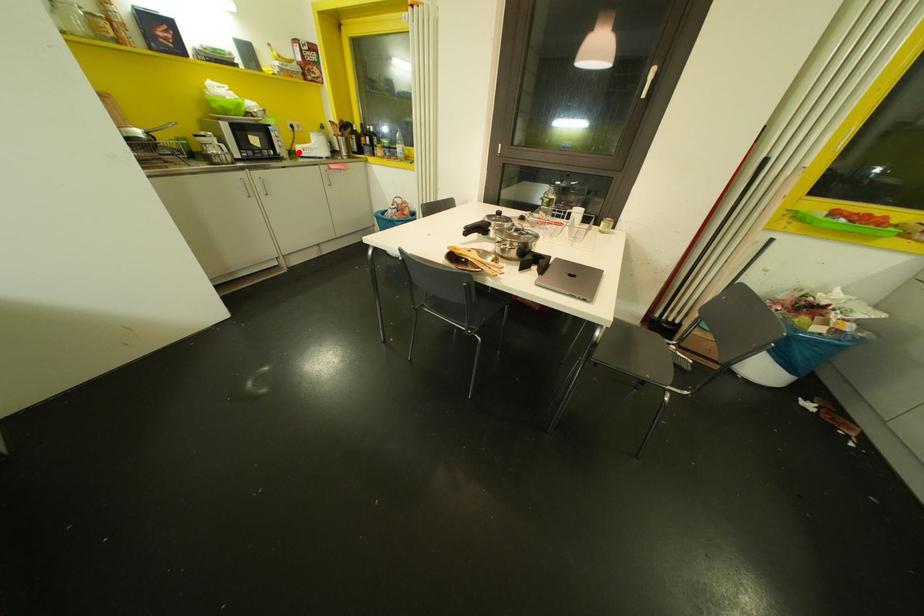
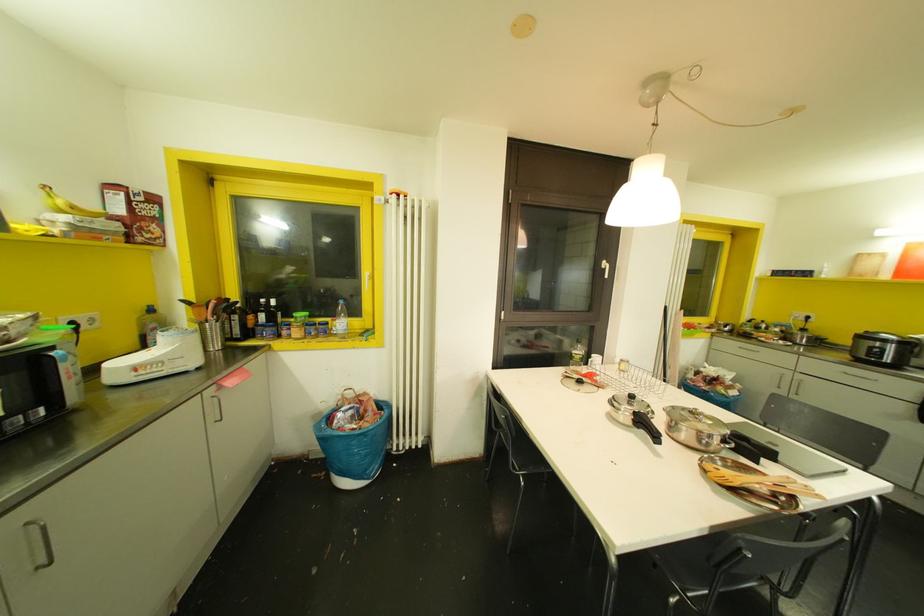
Find the pixel in the second image that matches the highlighted location in the first image.

(116, 378)